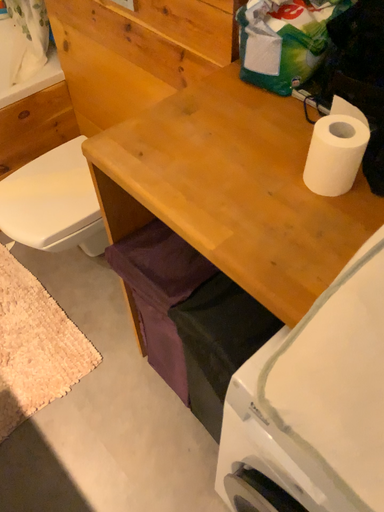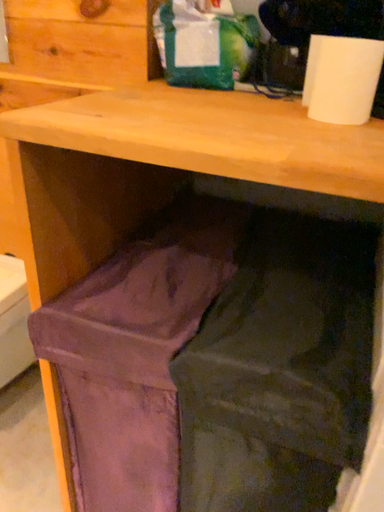
Question: Which way did the camera rotate in the video?

Choices:
 (A) rotated downward
 (B) rotated upward

Answer: (B)